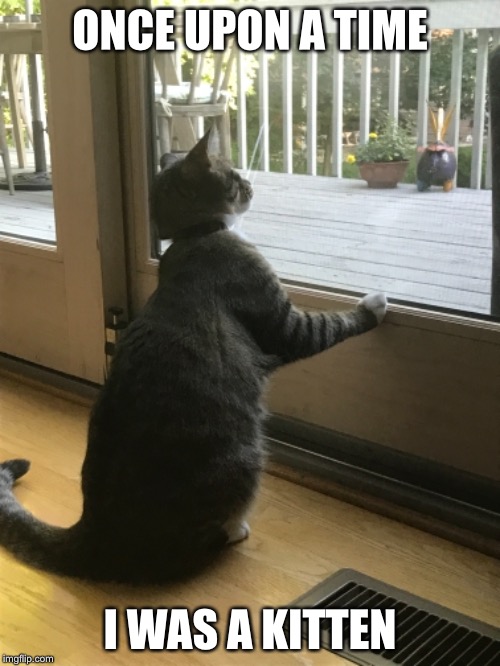
In order to click on windows in this screenshot , I will do `click(382, 166)`, `click(24, 80)`.